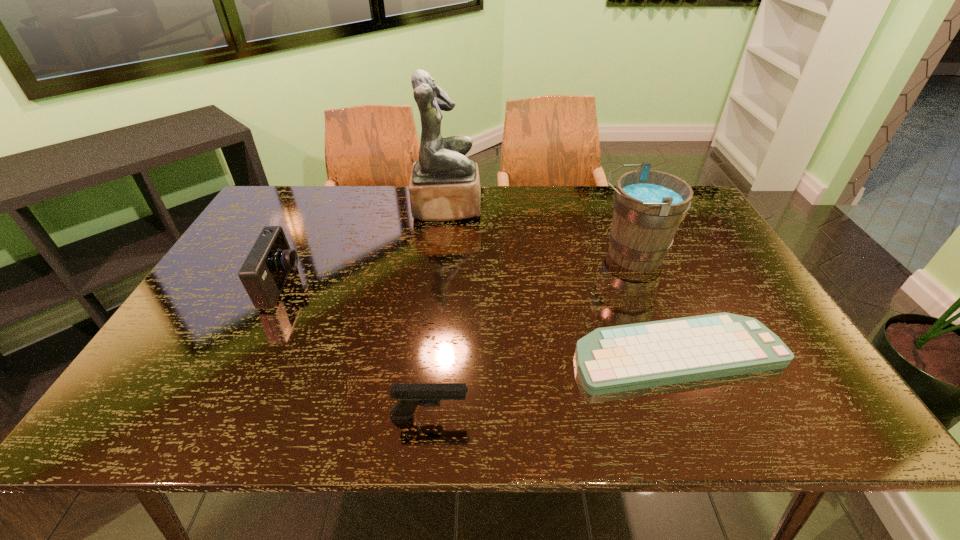
At what (x,y) coordinates should I click in order to perform the action: click on vacant region located with a handle on the side of the wine bucket. Please return your answer as a coordinate pair (x, y). The image size is (960, 540). Looking at the image, I should click on (535, 254).

What are the coordinates of `vacant space located with a handle on the side of the wine bucket` in the screenshot? It's located at (477, 254).

This screenshot has height=540, width=960. In order to click on vacant space located with a handle on the side of the wine bucket in this screenshot , I will do `click(456, 254)`.

In order to click on free spot located 0.310m on the front-facing side of the camera in this screenshot , I will do `click(414, 286)`.

Locate an element on the screen. This screenshot has width=960, height=540. free region located on the front-facing side of the pistol is located at coordinates (661, 416).

The height and width of the screenshot is (540, 960). In order to click on vacant space situated on the back of the computer keyboard in this screenshot , I will do `click(631, 244)`.

In order to click on object located in the far edge section of the desktop in this screenshot , I will do `click(444, 185)`.

Where is `pistol that is at the near edge`? The width and height of the screenshot is (960, 540). pistol that is at the near edge is located at coordinates (410, 395).

Identify the location of computer keyboard located in the near edge section of the desktop. The width and height of the screenshot is (960, 540). (620, 358).

I want to click on object that is at the left edge, so click(x=263, y=274).